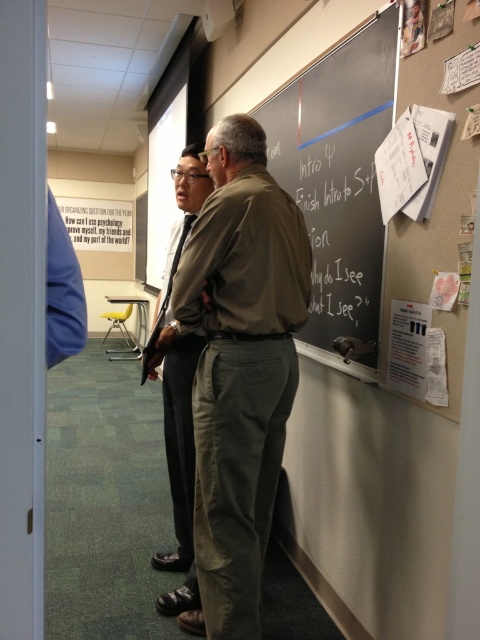
You are a student trying to take notes in the classroom. The black chalkboard writing at upper center and the white paper at right are both visible. Which one has larger text that is easier to read from a distance?

The black chalkboard writing at upper center has larger text than the white paper at right, so it is easier to read from a distance.